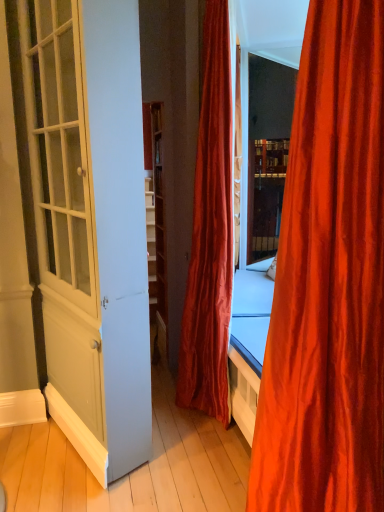
Find the location of a particular element. Image resolution: width=384 pixels, height=512 pixels. vacant area located to the right-hand side of white glossy door at left is located at coordinates (188, 456).